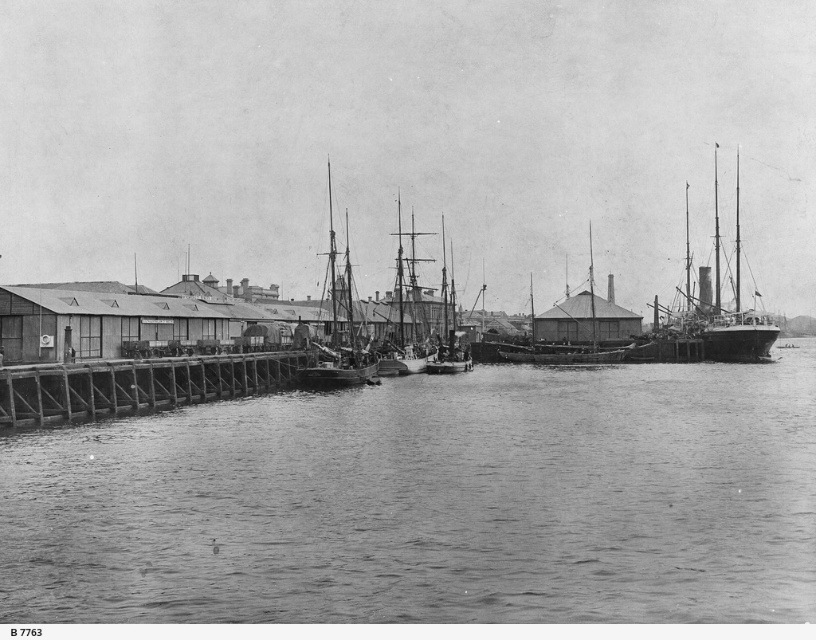
You are a photographer trying to capture both the wooden dock at lower left and the smooth steel ship at right in a single frame. Based on their sizes, which object should you focus on first to ensure both fit in the photo?

The wooden dock at lower left is smaller than the smooth steel ship at right, so you should focus on the smooth steel ship at right first to ensure both fit in the photo since it takes up more space.